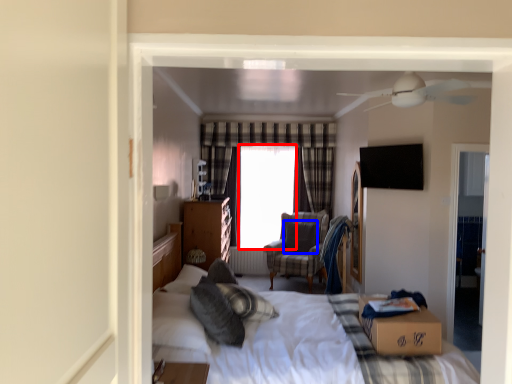
Question: Which of the following is the closest to the observer, window screen (highlighted by a red box) or pillow (highlighted by a blue box)?

Choices:
 (A) window screen
 (B) pillow

Answer: (B)